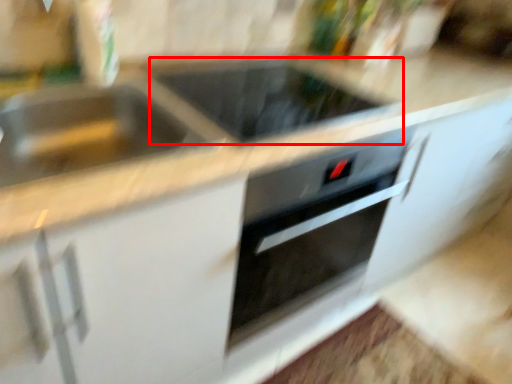
Question: From the image's perspective, considering the relative positions of appliance (annotated by the red box) and sink in the image provided, where is appliance (annotated by the red box) located with respect to the staircase?

Choices:
 (A) below
 (B) above

Answer: (B)